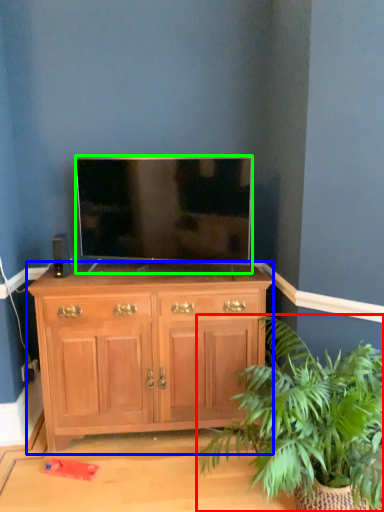
Question: Estimate the real-world distances between objects in this image. Which object is farther from houseplant (highlighted by a red box), chest of drawers (highlighted by a blue box) or television (highlighted by a green box)?

Choices:
 (A) chest of drawers
 (B) television

Answer: (B)